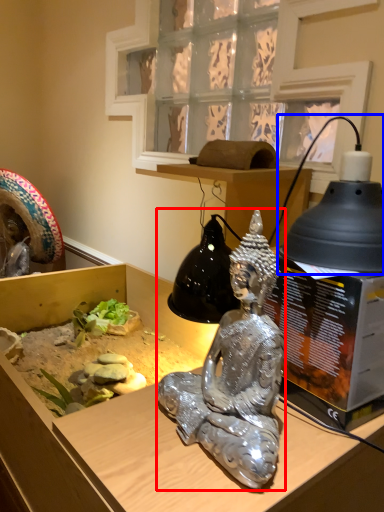
Question: Which object is further to the camera taking this photo, person (highlighted by a red box) or lamp (highlighted by a blue box)?

Choices:
 (A) person
 (B) lamp

Answer: (B)